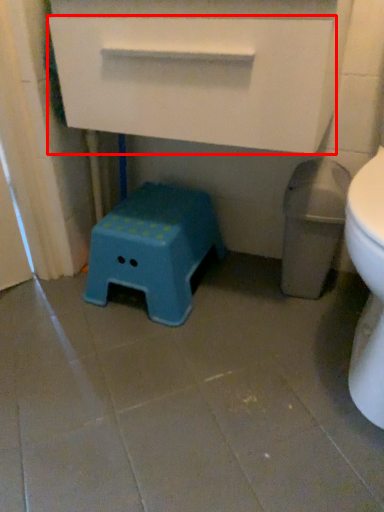
Question: Where is drawer (annotated by the red box) located in relation to stool in the image?

Choices:
 (A) left
 (B) right

Answer: (B)